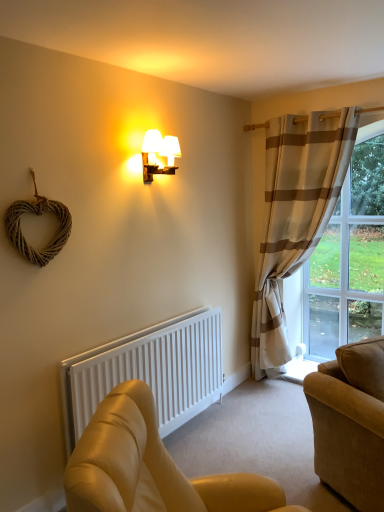
Question: Is the surface of white matte radiator at lower left in direct contact with matte gold wall sconce at upper center?

Choices:
 (A) no
 (B) yes

Answer: (A)

Question: Is white matte radiator at lower left further to the viewer compared to matte gold wall sconce at upper center?

Choices:
 (A) no
 (B) yes

Answer: (A)

Question: Can we say white matte radiator at lower left lies outside matte gold wall sconce at upper center?

Choices:
 (A) no
 (B) yes

Answer: (B)

Question: From the image's perspective, is white matte radiator at lower left under matte gold wall sconce at upper center?

Choices:
 (A) yes
 (B) no

Answer: (A)

Question: From a real-world perspective, is white matte radiator at lower left under matte gold wall sconce at upper center?

Choices:
 (A) yes
 (B) no

Answer: (A)

Question: Can you confirm if white matte radiator at lower left is bigger than matte gold wall sconce at upper center?

Choices:
 (A) yes
 (B) no

Answer: (A)

Question: Is leather couch at lower right, positioned as the 2th studio couch in back-to-front order, touching suede-like beige couch at lower right, the 2th studio couch from the front?

Choices:
 (A) yes
 (B) no

Answer: (B)

Question: Is leather couch at lower right, acting as the first studio couch starting from the front, positioned before suede-like beige couch at lower right, the 2th studio couch from the front?

Choices:
 (A) no
 (B) yes

Answer: (B)

Question: Is leather couch at lower right, acting as the first studio couch starting from the front, to the right of suede-like beige couch at lower right, acting as the first studio couch starting from the back, from the viewer's perspective?

Choices:
 (A) no
 (B) yes

Answer: (A)

Question: Is leather couch at lower right, positioned as the 2th studio couch in back-to-front order, not inside suede-like beige couch at lower right, acting as the first studio couch starting from the back?

Choices:
 (A) no
 (B) yes

Answer: (B)

Question: Can you confirm if leather couch at lower right, acting as the first studio couch starting from the front, is bigger than suede-like beige couch at lower right, the 2th studio couch from the front?

Choices:
 (A) no
 (B) yes

Answer: (A)

Question: Does leather couch at lower right, positioned as the 2th studio couch in back-to-front order, appear on the left side of clear glass window at right?

Choices:
 (A) no
 (B) yes

Answer: (B)